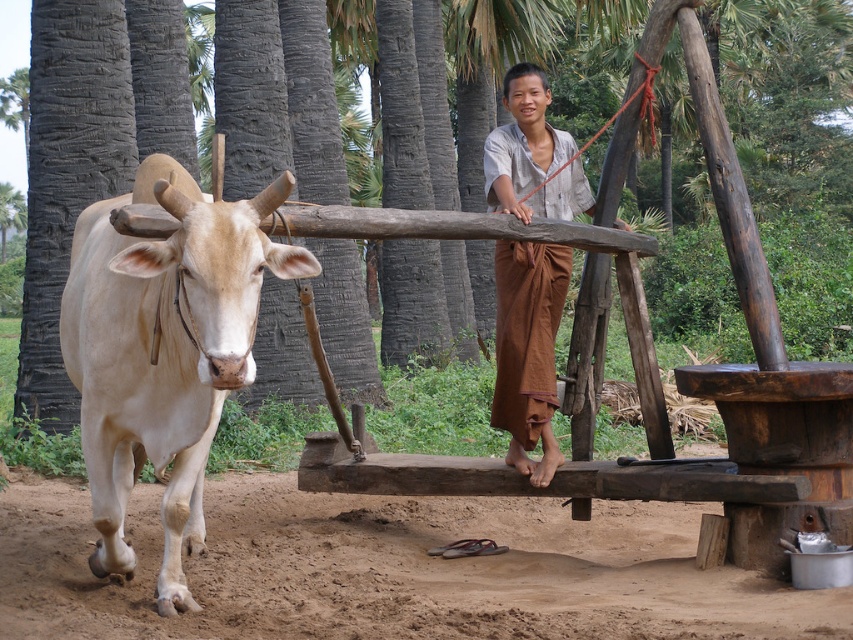
From the picture: You are standing in the rural scene and want to walk from the brown dirt field at lower center to the light beige horned bull at left. Which direction should you move relative to the bull?

The brown dirt field at lower center is positioned under the light beige horned bull at left, so you should move northward towards the bull to reach it from the field.

You are a farmer who needs to cross the brown dirt field at lower center to reach the light beige horned bull at left. Based on their positions, which direction should you move from the field to approach the bull?

The brown dirt field at lower center is positioned on the right side of the light beige horned bull at left, so you should move to the left from the field to approach the bull.

You are standing at the center of the image. The light beige horned bull at left is at point 0.545, 0.193. If you walk straight ahead, will you reach the bull before the edge of the image?

The light beige horned bull at left is located at coordinates [164,348]. Since the bull is already positioned in the foreground on the left side of the image, walking straight ahead from the center would not lead you towards the bull. Instead, you would move towards the center of the image or towards the background. Therefore, you would not reach the bull before the edge of the image.